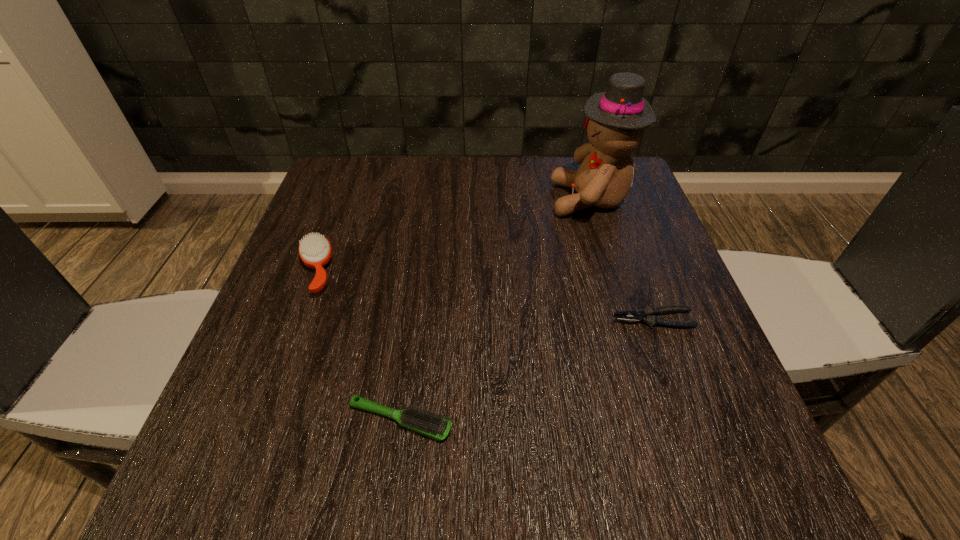
This screenshot has width=960, height=540. I want to click on free space located 0.180m on the front-facing side of the farthest object, so click(476, 200).

The height and width of the screenshot is (540, 960). I want to click on free space located on the right of the left hairbrush, so click(420, 271).

The height and width of the screenshot is (540, 960). In order to click on vacant space situated 0.250m on the back of the nearer hairbrush in this screenshot , I will do `click(419, 284)`.

This screenshot has width=960, height=540. What are the coordinates of `vacant space located at the gripping part of the third farthest object` in the screenshot? It's located at (476, 320).

Find the location of a particular element. vacant region located 0.400m at the gripping part of the third farthest object is located at coordinates (394, 320).

The image size is (960, 540). Find the location of `vacant space located 0.280m at the gripping part of the third farthest object`. vacant space located 0.280m at the gripping part of the third farthest object is located at coordinates (460, 320).

Where is `object located in the far edge section of the desktop`? object located in the far edge section of the desktop is located at coordinates point(615,119).

This screenshot has width=960, height=540. Identify the location of object present at the near edge. coord(433,425).

Where is `object present at the left edge`? object present at the left edge is located at coordinates (315, 251).

Find the location of a particular element. Image resolution: width=960 pixels, height=540 pixels. rag_doll at the right edge is located at coordinates (615, 119).